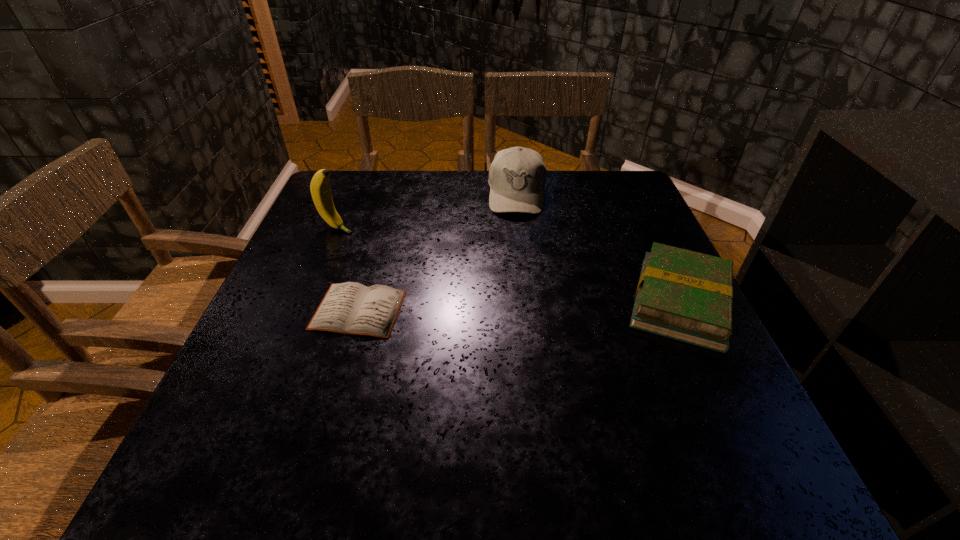
The width and height of the screenshot is (960, 540). In order to click on vacant space on the desktop that is between the shortest object and the rightmost object and is positioned on the front-facing side of the second tallest object in this screenshot , I will do `click(511, 306)`.

Find the location of a particular element. free space on the desktop that is between the diary and the second shortest object and is positioned from the stem of the tallest object is located at coordinates (537, 306).